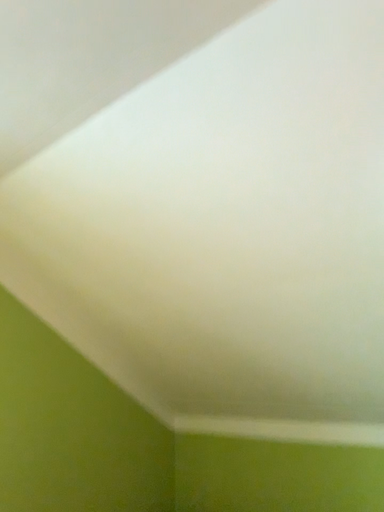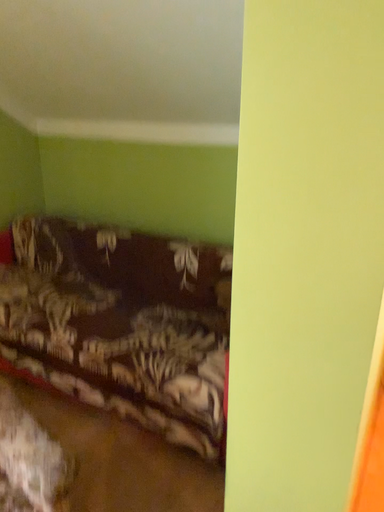
Question: Which way did the camera rotate in the video?

Choices:
 (A) rotated downward
 (B) rotated upward

Answer: (A)